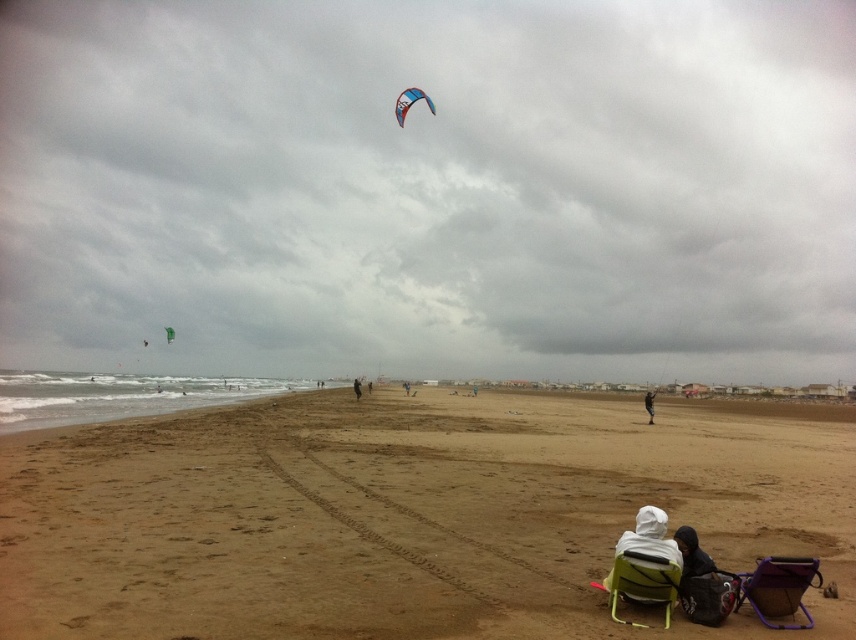
You are a bird soaring above the beach scene. You notice two kites flying in the sky. Which kite is higher in the sky between the blue glossy kite at upper center and the green fabric kite at upper left?

The blue glossy kite at upper center is higher in the sky than the green fabric kite at upper left because it is located above it.

You are standing on the beach and want to walk from the white fleece jacket at lower right to the green fabric kite at upper left. How far will you have to walk?

The white fleece jacket at lower right is 679.32 feet from the green fabric kite at upper left, so you will have to walk 679.32 feet to reach it.